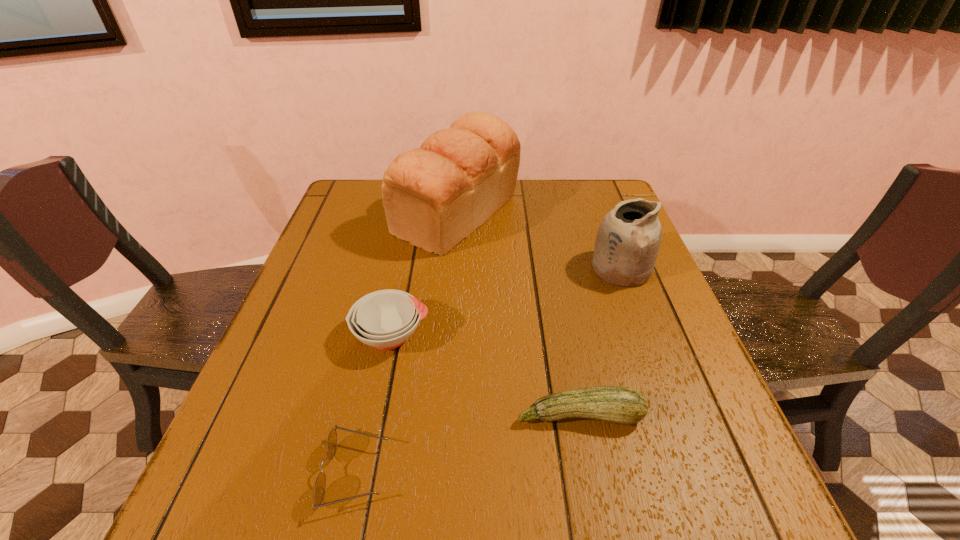
Find the location of a particular element. This screenshot has width=960, height=540. free location located on the front-facing side of the nearest object is located at coordinates (600, 473).

At what (x,y) coordinates should I click in order to perform the action: click on object located at the far edge. Please return your answer as a coordinate pair (x, y). Looking at the image, I should click on click(x=434, y=196).

At what (x,y) coordinates should I click in order to perform the action: click on object located in the near edge section of the desktop. Please return your answer as a coordinate pair (x, y). The image size is (960, 540). Looking at the image, I should click on (319, 490).

This screenshot has width=960, height=540. Identify the location of pottery at the right edge. (627, 243).

You are a GUI agent. You are given a task and a screenshot of the screen. Output one action in this format:
    pyautogui.click(x=<x>, y=<y>)
    Task: Click on the zucchini positioned at the right edge
    This screenshot has height=540, width=960.
    Given the screenshot: What is the action you would take?
    pyautogui.click(x=619, y=404)

In the image, there is a desktop. Where is `free region at the far edge`? Image resolution: width=960 pixels, height=540 pixels. free region at the far edge is located at coordinates (517, 209).

Image resolution: width=960 pixels, height=540 pixels. In the image, there is a desktop. Find the location of `blank space at the near edge`. blank space at the near edge is located at coordinates point(566,511).

At what (x,y) coordinates should I click in order to perform the action: click on vacant space at the left edge of the desktop. Please return your answer as a coordinate pair (x, y). The image size is (960, 540). Looking at the image, I should click on (262, 398).

You are a GUI agent. You are given a task and a screenshot of the screen. Output one action in this format:
    pyautogui.click(x=<x>, y=<y>)
    Task: Click on the vacant area at the right edge of the desktop
    The width and height of the screenshot is (960, 540).
    Given the screenshot: What is the action you would take?
    pyautogui.click(x=708, y=382)

Find the location of a particular element. The width and height of the screenshot is (960, 540). blank space at the far right corner of the desktop is located at coordinates (580, 217).